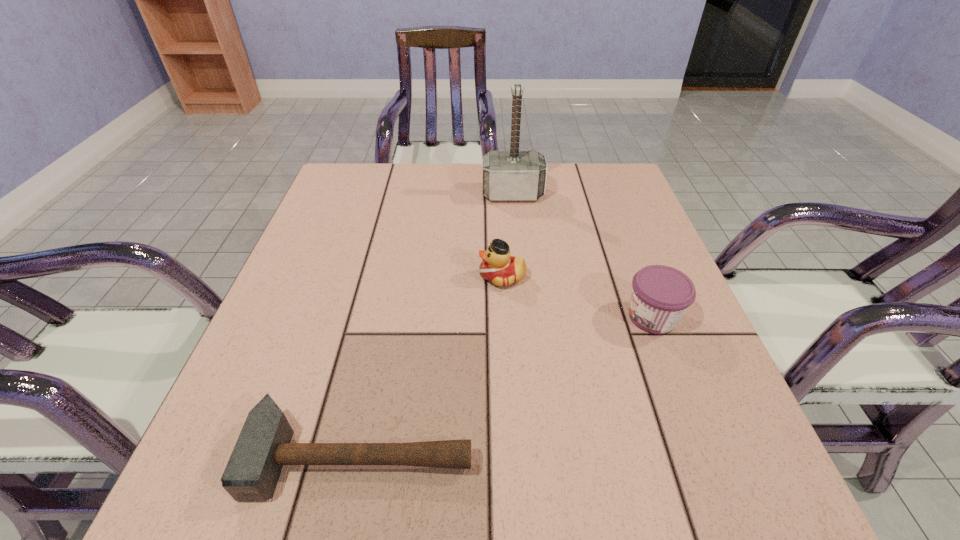
Identify the location of vacant space positioned on the face of the second farthest object. The height and width of the screenshot is (540, 960). point(403,276).

This screenshot has height=540, width=960. Identify the location of free space located on the front label of the jam. (546, 317).

Image resolution: width=960 pixels, height=540 pixels. In order to click on free location located on the front label of the jam in this screenshot , I will do `click(588, 317)`.

This screenshot has height=540, width=960. Identify the location of vacant region located 0.330m on the front label of the jam. (453, 317).

Identify the location of object present at the far edge. Image resolution: width=960 pixels, height=540 pixels. (514, 175).

I want to click on object at the near edge, so click(x=264, y=445).

Find the location of `object at the left edge`. object at the left edge is located at coordinates (264, 445).

Where is `object located in the right edge section of the desktop`? object located in the right edge section of the desktop is located at coordinates (660, 296).

At what (x,y) coordinates should I click in order to perform the action: click on object that is positioned at the near left corner. Please return your answer as a coordinate pair (x, y). Looking at the image, I should click on (264, 445).

In the image, there is a desktop. Where is `vacant space at the far edge`? Image resolution: width=960 pixels, height=540 pixels. vacant space at the far edge is located at coordinates (396, 191).